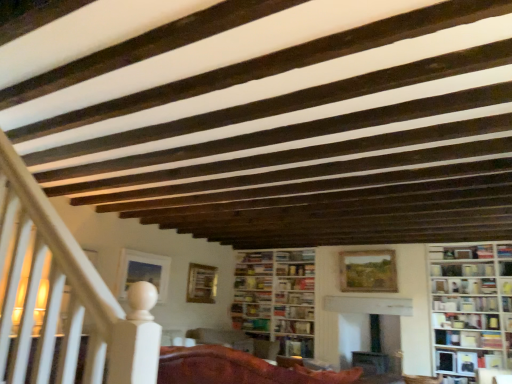
Question: Can you confirm if wooden textured picture frame at center, the 3th picture frame viewed from the left, is taller than wooden bookshelf at lower right?

Choices:
 (A) no
 (B) yes

Answer: (B)

Question: Does wooden textured picture frame at center, which is the 1th picture frame from right to left, appear on the right side of wooden bookshelf at lower right?

Choices:
 (A) no
 (B) yes

Answer: (A)

Question: From a real-world perspective, is wooden textured picture frame at center, which is the 1th picture frame from right to left, on top of wooden bookshelf at lower right?

Choices:
 (A) no
 (B) yes

Answer: (B)

Question: Does wooden textured picture frame at center, which is the 1th picture frame from right to left, have a larger size compared to wooden bookshelf at lower right?

Choices:
 (A) no
 (B) yes

Answer: (B)

Question: Can we say wooden textured picture frame at center, the 3th picture frame viewed from the left, lies outside wooden bookshelf at lower right?

Choices:
 (A) no
 (B) yes

Answer: (B)

Question: From the image's perspective, is wooden textured picture frame at center, the 3th picture frame viewed from the left, on top of wooden bookshelf at lower right?

Choices:
 (A) no
 (B) yes

Answer: (B)

Question: Is matte white bookshelf at lower right, the fourth book in the top-to-bottom sequence, shorter than matte wooden picture frame at upper left, the 3th picture frame positioned from the right?

Choices:
 (A) yes
 (B) no

Answer: (A)

Question: Does matte white bookshelf at lower right, the fourth book in the top-to-bottom sequence, appear on the left side of matte wooden picture frame at upper left, the first picture frame in the left-to-right sequence?

Choices:
 (A) no
 (B) yes

Answer: (A)

Question: Is matte white bookshelf at lower right, the fourth book in the top-to-bottom sequence, positioned beyond the bounds of matte wooden picture frame at upper left, the first picture frame in the left-to-right sequence?

Choices:
 (A) no
 (B) yes

Answer: (B)

Question: Does matte white bookshelf at lower right, the third book ordered from the bottom, have a greater height compared to matte wooden picture frame at upper left, the 3th picture frame positioned from the right?

Choices:
 (A) no
 (B) yes

Answer: (A)

Question: Can you confirm if matte white bookshelf at lower right, the fourth book in the top-to-bottom sequence, is thinner than matte wooden picture frame at upper left, the 3th picture frame positioned from the right?

Choices:
 (A) no
 (B) yes

Answer: (A)

Question: Can you confirm if matte white bookshelf at lower right, the third book ordered from the bottom, is wider than matte wooden picture frame at upper left, the 3th picture frame positioned from the right?

Choices:
 (A) no
 (B) yes

Answer: (B)

Question: Can you confirm if hardcover book at center, positioned as the 1th book in bottom-to-top order, is smaller than wooden bookshelf at lower right?

Choices:
 (A) no
 (B) yes

Answer: (A)